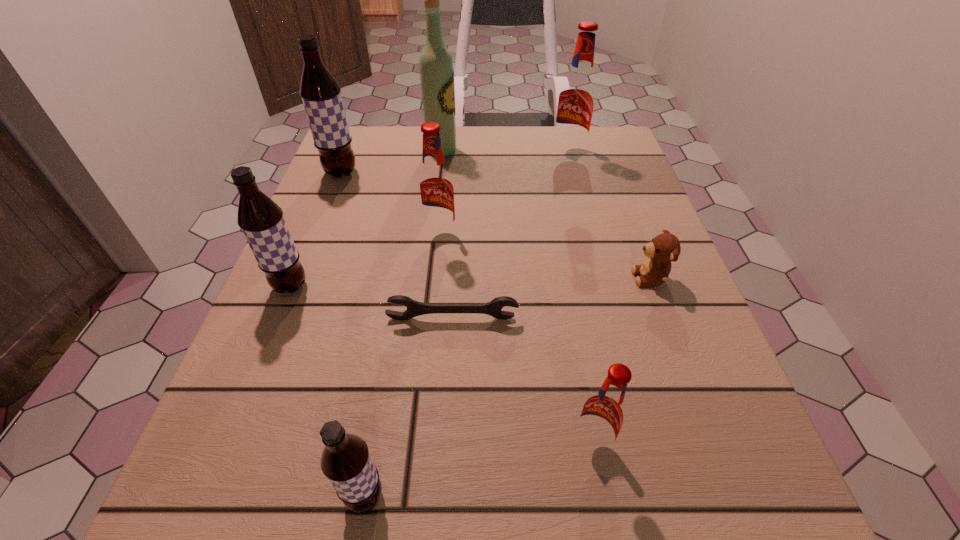
I want to click on root beer at the right edge, so click(x=577, y=96).

In order to click on teddy bear located at the right edge in this screenshot , I will do `click(663, 249)`.

The image size is (960, 540). I want to click on object positioned at the far left corner, so click(321, 95).

Identify the location of object that is at the far right corner. (577, 96).

Locate an element on the screen. vacant point at the far edge is located at coordinates (547, 134).

The image size is (960, 540). Find the location of `free space at the left edge of the desktop`. free space at the left edge of the desktop is located at coordinates (350, 225).

This screenshot has width=960, height=540. I want to click on free region at the right edge, so click(x=634, y=216).

I want to click on free point at the far left corner, so click(x=353, y=136).

I want to click on vacant area at the far right corner, so click(614, 139).

Locate an element on the screen. This screenshot has width=960, height=540. unoccupied area between the fourth nearest root beer and the fourth farthest root beer is located at coordinates (365, 261).